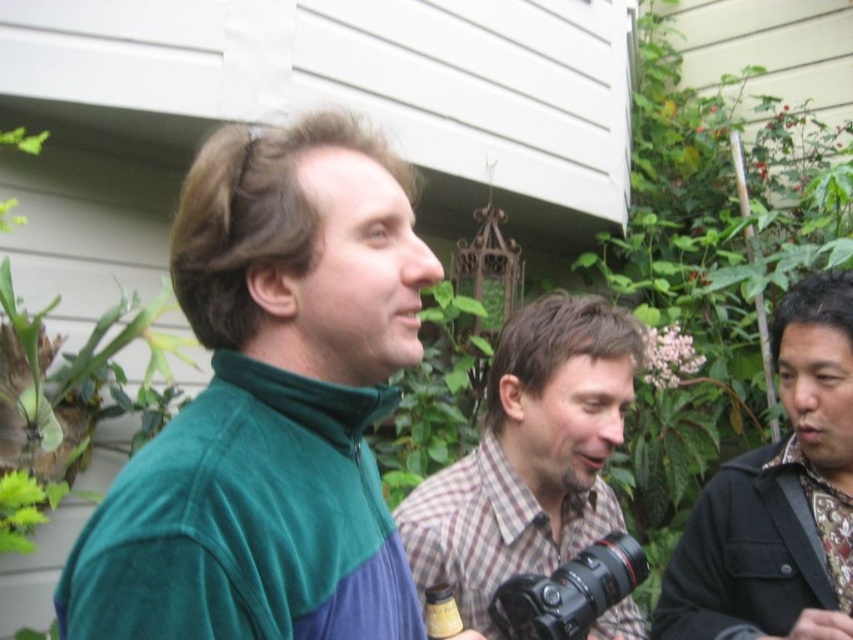
Question: Is the position of plaid fabric shirt at center more distant than that of black plastic camera at center?

Choices:
 (A) yes
 (B) no

Answer: (A)

Question: Which object is closer to the camera taking this photo?

Choices:
 (A) green fleece jacket at center
 (B) black textured shirt at right

Answer: (A)

Question: Can you confirm if plaid fabric shirt at center is thinner than black plastic camera at center?

Choices:
 (A) yes
 (B) no

Answer: (B)

Question: Which of the following is the farthest from the observer?

Choices:
 (A) black plastic camera at center
 (B) plaid fabric shirt at center
 (C) black textured shirt at right
 (D) green fleece jacket at center

Answer: (C)

Question: Which point is closer to the camera?

Choices:
 (A) (607, 545)
 (B) (335, 138)
 (C) (785, 513)

Answer: (B)

Question: Observing the image, what is the correct spatial positioning of green fleece jacket at center in reference to black plastic camera at center?

Choices:
 (A) right
 (B) left

Answer: (B)